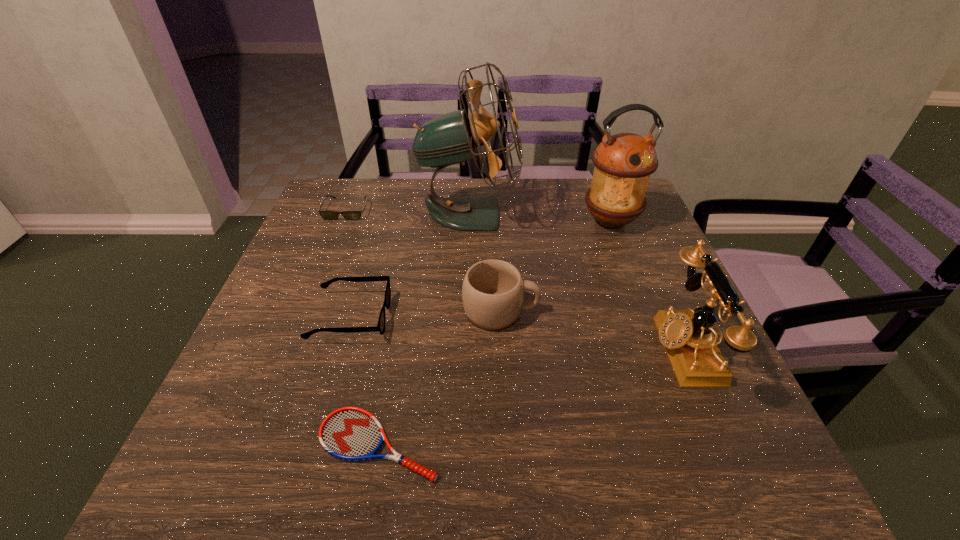
Image resolution: width=960 pixels, height=540 pixels. Find the location of `fan`. fan is located at coordinates [x=451, y=138].

In order to click on oil lamp in this screenshot , I will do `click(624, 162)`.

In order to click on telephone in this screenshot , I will do `click(687, 336)`.

Locate an element on the screen. mug is located at coordinates tap(493, 290).

Locate an element on the screen. This screenshot has height=540, width=960. spectacles is located at coordinates (380, 327).

Image resolution: width=960 pixels, height=540 pixels. In order to click on sunglasses in this screenshot , I will do `click(327, 215)`.

Locate an element on the screen. the shortest object is located at coordinates (349, 433).

This screenshot has width=960, height=540. I want to click on the nearest object, so click(349, 433).

Locate an element on the screen. The image size is (960, 540). vacant position located 0.190m on the front-facing side of the fan for air flow is located at coordinates (x=585, y=213).

At what (x,y) coordinates should I click in order to perform the action: click on vacant space located on the back of the oil lamp. Please return your answer as a coordinate pair (x, y). The width and height of the screenshot is (960, 540). Looking at the image, I should click on (601, 195).